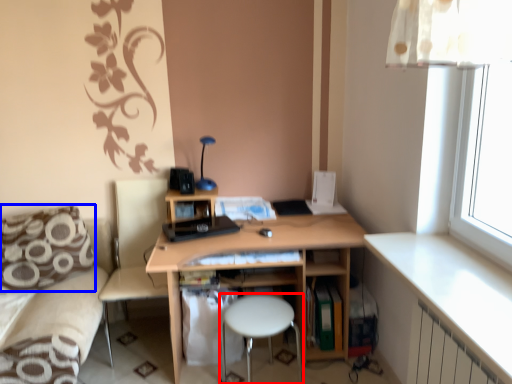
Question: Which point is further to the camera, bar stool (highlighted by a red box) or pillow (highlighted by a blue box)?

Choices:
 (A) bar stool
 (B) pillow

Answer: (B)